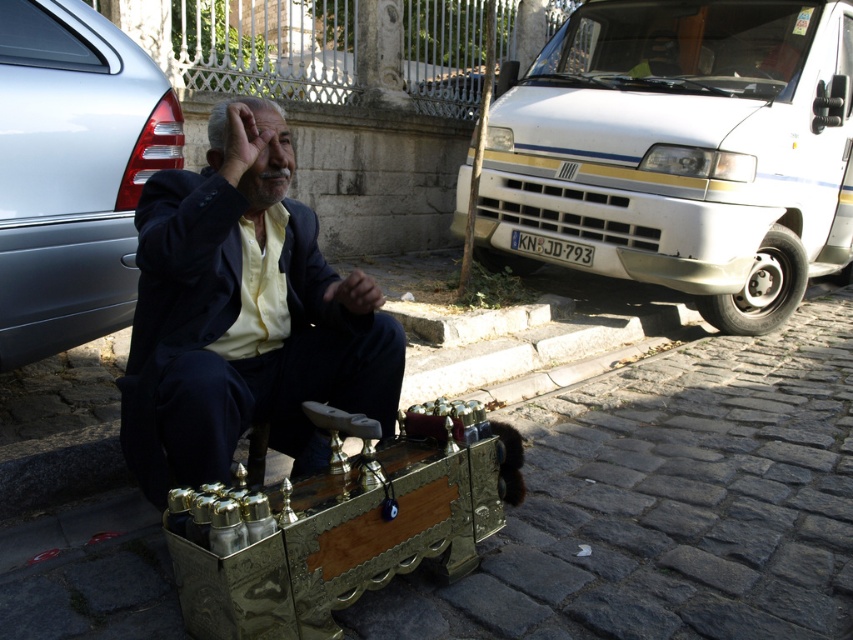
You are a delivery person who needs to place a package between the matte black suit at center and the metallic silver car at left. The package is 45 centimeters wide. Will it fit in the space between them?

The space between the matte black suit at center and the metallic silver car at left is 46.50 centimeters. Since the package is 45 centimeters wide, it will fit with 1.50 centimeters of space remaining.

You are a pedestrian standing in the middle of the street. You see a white metallic van at upper right and a metallic silver car at left. Which vehicle is located to your right side?

→ The white metallic van at upper right is positioned on the right side of metallic silver car at left, so from your perspective in the middle of the street, the white metallic van at upper right would be to your right side.